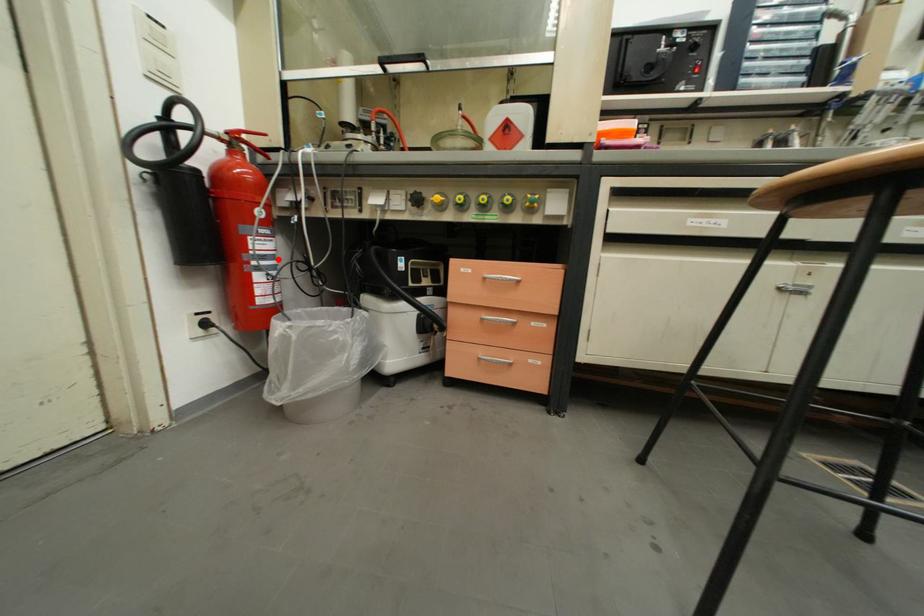
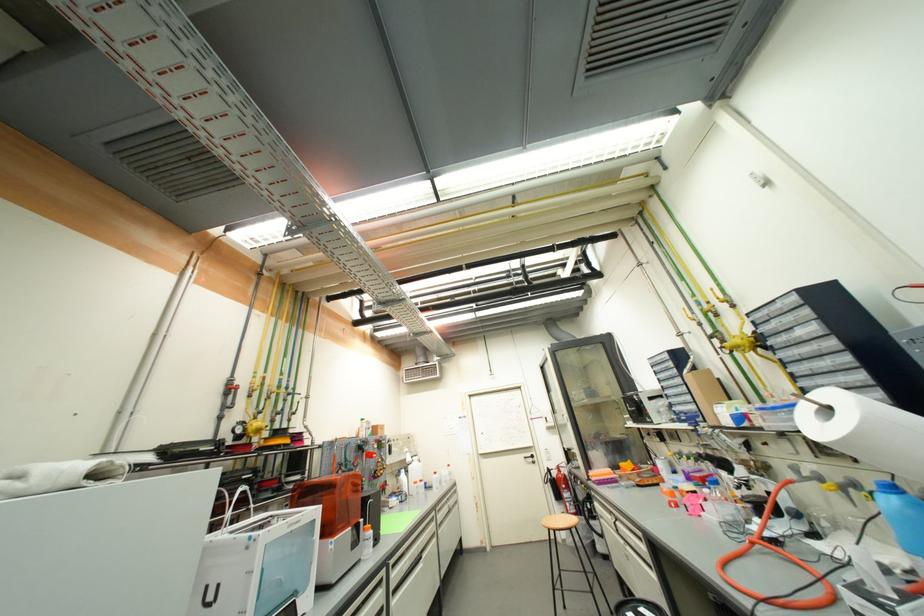
Question: A red point is marked in image1. In image2, is the corresponding 3D point closer to the camera or farther? Reply with the corresponding letter.

Choices:
 (A) The corresponding 3D point is closer.
 (B) The corresponding 3D point is farther.

Answer: (B)